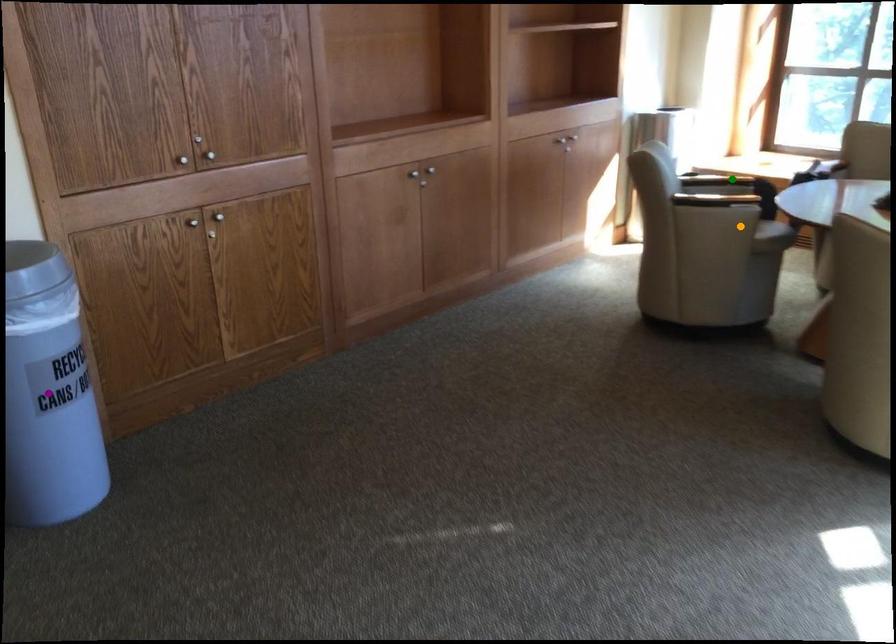
Order these from nearest to farthest:
A) green point
B) purple point
C) orange point

purple point < orange point < green point